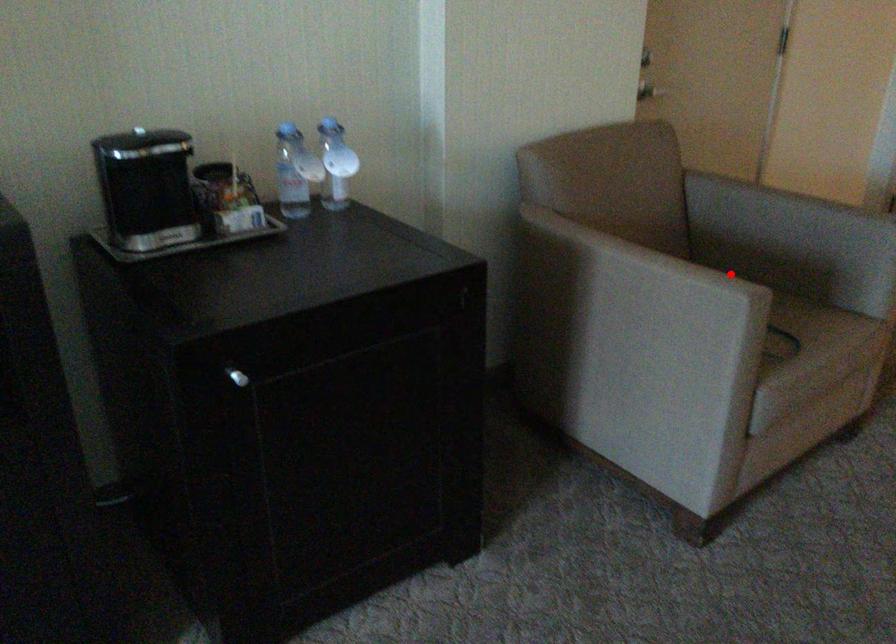
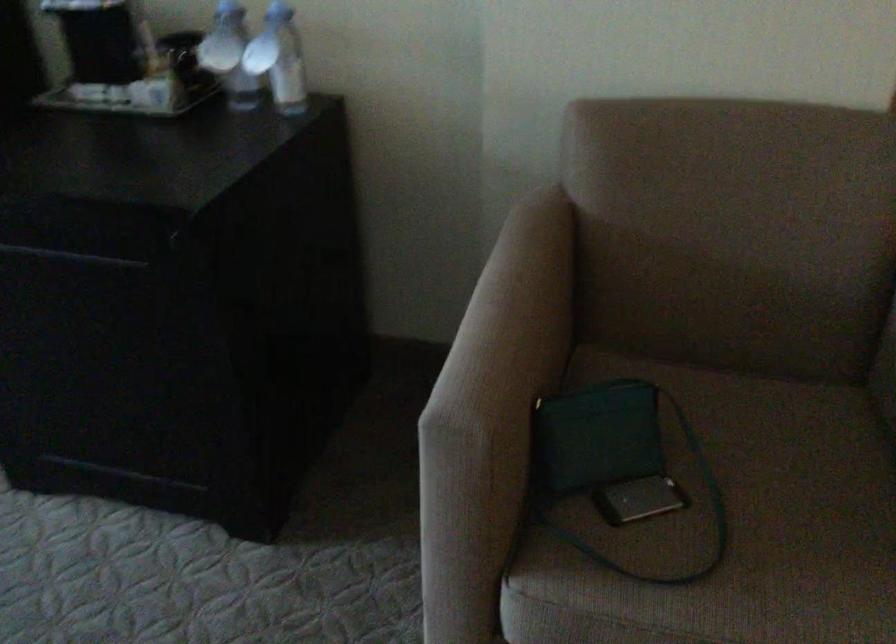
Question: A red point is marked in image1. In image2, is the corresponding 3D point closer to the camera or farther? Reply with the corresponding letter.

Choices:
 (A) The corresponding 3D point is closer.
 (B) The corresponding 3D point is farther.

Answer: (A)